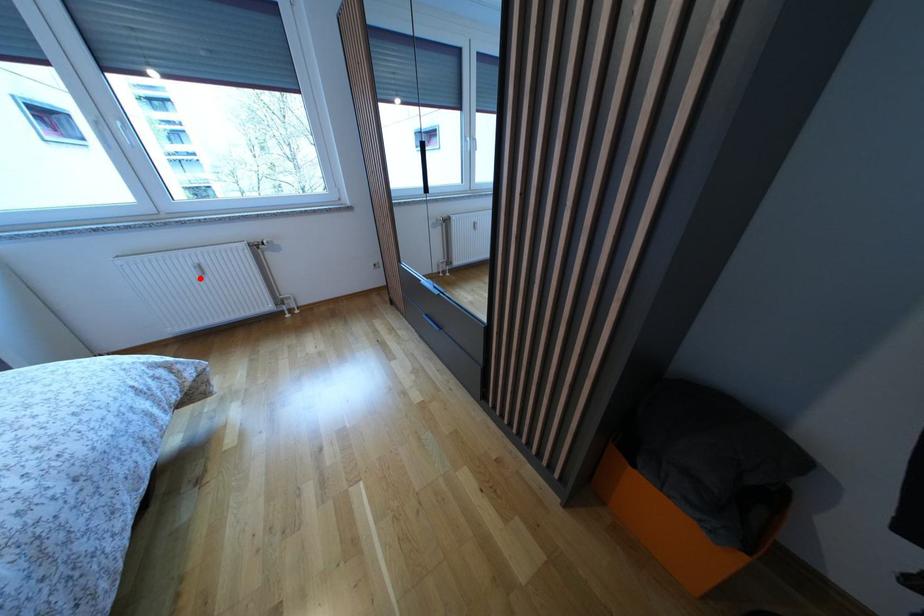
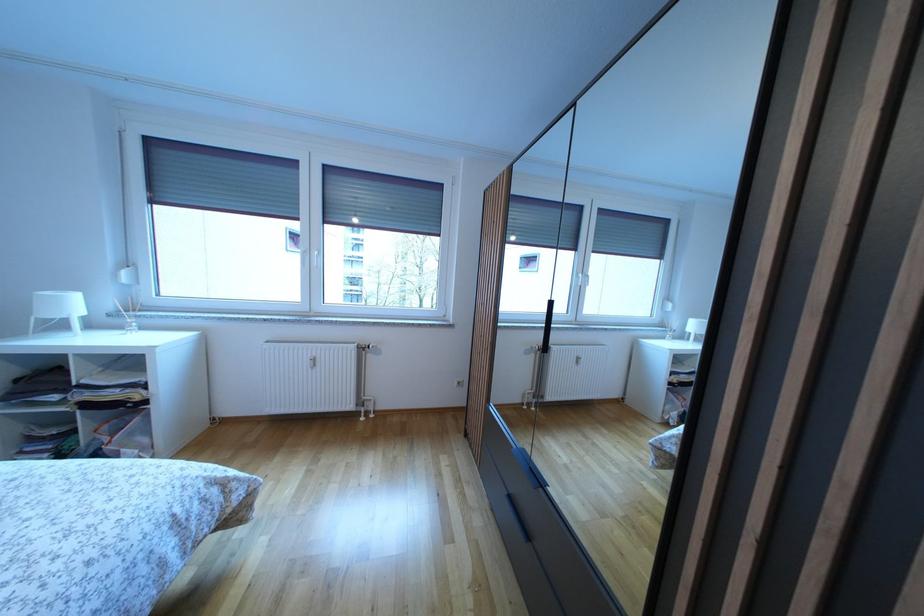
Question: I am providing you with two images of the same scene from different viewpoints. A red point is shown in image1. For the corresponding object point in image2, is it positioned nearer or farther from the camera?

Choices:
 (A) Nearer
 (B) Farther

Answer: (B)